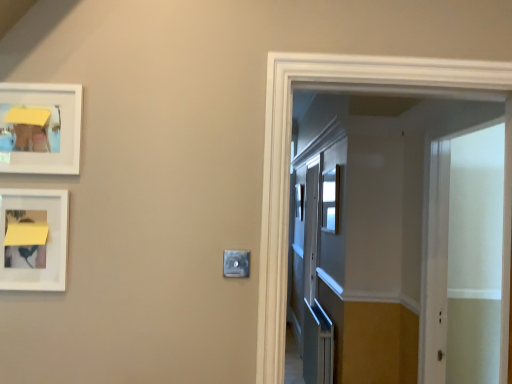
Identify the location of satin silver switch at center. The width and height of the screenshot is (512, 384). (236, 263).

This screenshot has height=384, width=512. Describe the element at coordinates (236, 263) in the screenshot. I see `satin silver switch at center` at that location.

Find the location of a particular element. white matte picture frame at left, marked as the 1th picture frame in a bottom-to-top arrangement is located at coordinates (x=33, y=239).

This screenshot has height=384, width=512. Describe the element at coordinates (465, 257) in the screenshot. I see `white translucent screen door at right` at that location.

Locate an element on the screen. This screenshot has height=384, width=512. white glossy elevator at center is located at coordinates (289, 152).

Between clear glass window at center and satin silver switch at center, which one is positioned in front?

satin silver switch at center is closer to the camera.

How many degrees apart are the facing directions of clear glass window at center and satin silver switch at center?

The angular difference between clear glass window at center and satin silver switch at center is 90 degrees.

Considering the sizes of clear glass window at center and satin silver switch at center in the image, is clear glass window at center wider or thinner than satin silver switch at center?

Considering their sizes, clear glass window at center looks broader than satin silver switch at center.

Are clear glass window at center and satin silver switch at center located far from each other?

Yes.

How different are the orientations of white glossy elevator at center and white translucent screen door at right in degrees?

The angle between the facing direction of white glossy elevator at center and the facing direction of white translucent screen door at right is 90.9 degrees.

Between white glossy elevator at center and white translucent screen door at right, which one has less height?

white glossy elevator at center.

Is point (329, 81) less distant than point (497, 210)?

Yes.

Which object is closer to the camera taking this photo, white glossy elevator at center or white translucent screen door at right?

white glossy elevator at center is more forward.

Which of these two, satin silver switch at center or white matte picture frame at left, marked as the 1th picture frame in a bottom-to-top arrangement, is thinner?

Thinner between the two is satin silver switch at center.

From the image's perspective, which is below, satin silver switch at center or white matte picture frame at left, which appears as the second picture frame when viewed from the top?

satin silver switch at center appears lower in the image.

From a real-world perspective, who is located higher, satin silver switch at center or white matte picture frame at left, marked as the 1th picture frame in a bottom-to-top arrangement?

white matte picture frame at left, marked as the 1th picture frame in a bottom-to-top arrangement, from a real-world perspective.

Could clear glass window at center be considered to be inside satin silver switch at center?

No, clear glass window at center is not inside satin silver switch at center.

Can you confirm if satin silver switch at center is shorter than clear glass window at center?

Correct, satin silver switch at center is not as tall as clear glass window at center.

Locate an element on the screen. The image size is (512, 384). window behind the satin silver switch at center is located at coordinates (330, 200).

In terms of width, does satin silver switch at center look wider or thinner when compared to clear glass window at center?

satin silver switch at center is thinner than clear glass window at center.

Is point (437, 290) closer to viewer compared to point (325, 226)?

Yes, it is.

Considering the sizes of objects white translucent screen door at right and clear glass window at center in the image provided, who is smaller, white translucent screen door at right or clear glass window at center?

clear glass window at center.

From the image's perspective, is white translucent screen door at right under clear glass window at center?

Correct, white translucent screen door at right appears lower than clear glass window at center in the image.

Is white glossy elevator at center at the right side of satin silver switch at center?

Indeed, white glossy elevator at center is positioned on the right side of satin silver switch at center.

From a real-world perspective, is white glossy elevator at center positioned over satin silver switch at center based on gravity?

Yes, from a real-world perspective, white glossy elevator at center is above satin silver switch at center.

Is point (272, 134) less distant than point (247, 268)?

No, it is behind (247, 268).

Do you think white glossy elevator at center is within satin silver switch at center, or outside of it?

The correct answer is: outside.

Does white matte picture frame at left, marked as the 1th picture frame in a bottom-to-top arrangement, appear on the left side of white glossy elevator at center?

Correct, you'll find white matte picture frame at left, marked as the 1th picture frame in a bottom-to-top arrangement, to the left of white glossy elevator at center.

How many degrees apart are the facing directions of white matte picture frame at left, which appears as the second picture frame when viewed from the top, and white glossy elevator at center?

They differ by 1.03 degrees in their facing directions.

Is point (22, 263) farther from viewer compared to point (426, 79)?

No, it is not.

Which of these two, white matte picture frame at left, marked as the 1th picture frame in a bottom-to-top arrangement, or white glossy elevator at center, is wider?

white glossy elevator at center.

The height and width of the screenshot is (384, 512). In order to click on light switch below the clear glass window at center (from the image's perspective) in this screenshot , I will do `click(236, 263)`.

Identify the location of elevator on the left side of white translucent screen door at right. Image resolution: width=512 pixels, height=384 pixels. (289, 152).

Looking at the image, which one is located further to white matte picture frame at upper left, the 1th picture frame from the top, white glossy elevator at center or white translucent screen door at right?

white translucent screen door at right lies further to white matte picture frame at upper left, the 1th picture frame from the top, than the other object.

Estimate the real-world distances between objects in this image. Which object is closer to white glossy elevator at center, satin silver switch at center or white translucent screen door at right?

The object closer to white glossy elevator at center is satin silver switch at center.

Looking at the image, which one is located further to white matte picture frame at left, marked as the 1th picture frame in a bottom-to-top arrangement, white matte picture frame at upper left, which appears as the second picture frame when ordered from the bottom, or satin silver switch at center?

Based on the image, satin silver switch at center appears to be further to white matte picture frame at left, marked as the 1th picture frame in a bottom-to-top arrangement.

Which object lies further to the anchor point white glossy elevator at center, white matte picture frame at left, marked as the 1th picture frame in a bottom-to-top arrangement, or white matte picture frame at upper left, the 1th picture frame from the top?

white matte picture frame at left, marked as the 1th picture frame in a bottom-to-top arrangement, is further to white glossy elevator at center.

Looking at the image, which one is located further to white matte picture frame at left, which appears as the second picture frame when viewed from the top, satin silver switch at center or clear glass window at center?

Based on the image, clear glass window at center appears to be further to white matte picture frame at left, which appears as the second picture frame when viewed from the top.

Looking at the image, which one is located further to white glossy elevator at center, white matte picture frame at left, which appears as the second picture frame when viewed from the top, or clear glass window at center?

clear glass window at center lies further to white glossy elevator at center than the other object.

Based on their spatial positions, is white translucent screen door at right or white matte picture frame at left, marked as the 1th picture frame in a bottom-to-top arrangement, closer to satin silver switch at center?

white matte picture frame at left, marked as the 1th picture frame in a bottom-to-top arrangement.

Considering their positions, is satin silver switch at center positioned closer to clear glass window at center than white glossy elevator at center?

white glossy elevator at center is closer to clear glass window at center.

Where is `picture frame between white matte picture frame at left, which appears as the second picture frame when viewed from the top, and white translucent screen door at right, in the horizontal direction`? Image resolution: width=512 pixels, height=384 pixels. picture frame between white matte picture frame at left, which appears as the second picture frame when viewed from the top, and white translucent screen door at right, in the horizontal direction is located at coordinates (40, 128).

Where is `elevator located between satin silver switch at center and white translucent screen door at right in the left-right direction`? This screenshot has height=384, width=512. elevator located between satin silver switch at center and white translucent screen door at right in the left-right direction is located at coordinates (289, 152).

Where is `screen door between white glossy elevator at center and clear glass window at center along the z-axis`? Image resolution: width=512 pixels, height=384 pixels. screen door between white glossy elevator at center and clear glass window at center along the z-axis is located at coordinates (465, 257).

Identify the location of picture frame located between white matte picture frame at left, which appears as the second picture frame when viewed from the top, and clear glass window at center in the depth direction. Image resolution: width=512 pixels, height=384 pixels. (40, 128).